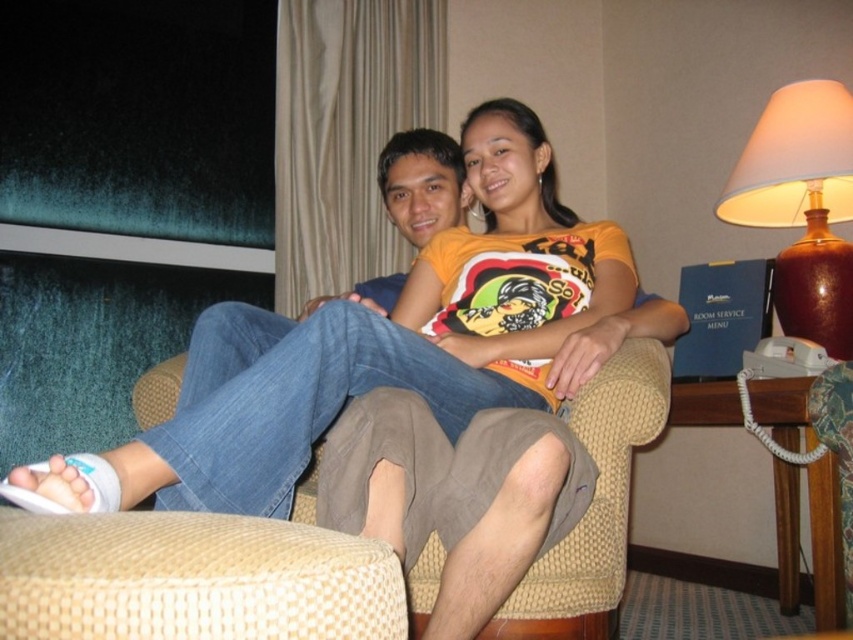
You are a hotel staff member who needs to determine if the white fabric sandals at lower left can fit into the storage compartment designed for items the size of brown ceramic lamp at upper right. Can they fit?

The white fabric sandals at lower left has a larger size compared to brown ceramic lamp at upper right, so they cannot fit into the storage compartment designed for items the size of brown ceramic lamp at upper right.

You are a photographer setting up a shot of the scene. You want to place a small prop exactly at the position of the white fabric sandals at lower left. What are the coordinates where you should place the prop?

The coordinates for the white fabric sandals at lower left are at point (381, 349), so you should place the prop at those coordinates.

Based on the photo, you are a photographer setting up for a group photo in the hotel room. You need to ensure that the white fabric sandals at lower left and the brown ceramic lamp at upper right are both visible in the frame. Based on their positions, which object is closer to the bottom of the image?

The white fabric sandals at lower left are closer to the bottom of the image because they are located below the brown ceramic lamp at upper right.